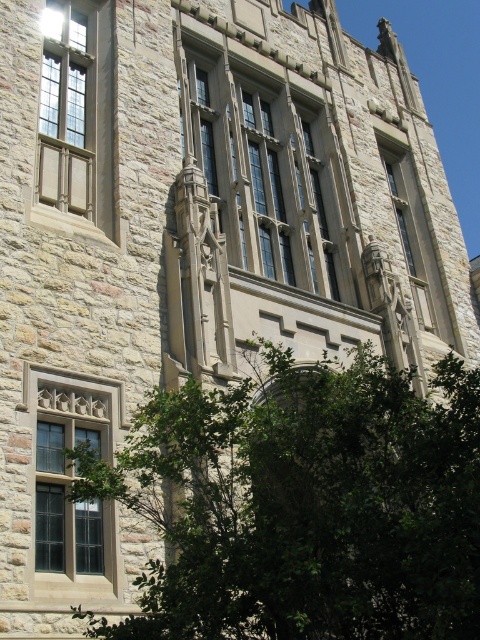
You are standing in front of a Gothic Revival building and notice two points marked on its facade. The first point is at coordinates point (280, 432) and the second is at point (340, 216). Which of these two points is closer to your current position?

Point (280, 432) is closer to the camera than point (340, 216), so the first point is closer to your position.

You are an architect analyzing the stone building. You observe two points on the facade labeled as point 1 at coordinates point (314, 205) and point 2 at coordinates point (79, 83). Based on their positions, which point is closer to the front of the building?

Point 2 at coordinates point (79, 83) is closer to the front of the building because it is in front of point 1 at coordinates point (314, 205).

You are standing at the center of the image. Which direction should you look to see the green leafy tree at lower left?

The green leafy tree at lower left is located at point (303, 504), which is to the lower left from the center. Therefore, you should look towards the lower left direction to see it.